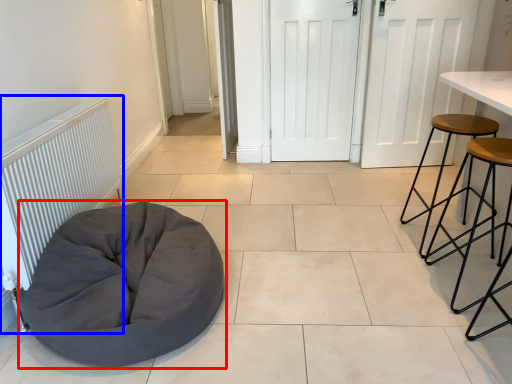
Question: Among these objects, which one is nearest to the camera, furniture (highlighted by a red box) or radiator (highlighted by a blue box)?

Choices:
 (A) furniture
 (B) radiator

Answer: (A)